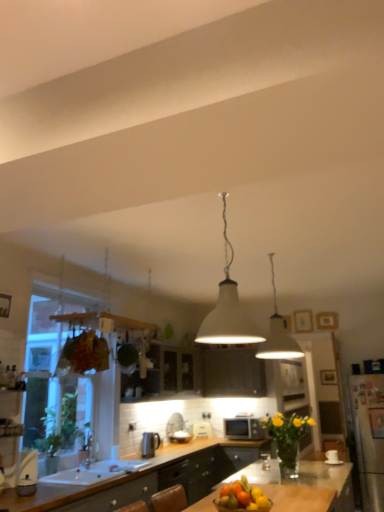
Question: From a real-world perspective, is white glossy sink at lower left physically located above or below transparent glass window at left?

Choices:
 (A) above
 (B) below

Answer: (B)

Question: Looking at the image, does white glossy sink at lower left seem bigger or smaller compared to transparent glass window at left?

Choices:
 (A) big
 (B) small

Answer: (B)

Question: Which object is the farthest from the matte black microwave at center?

Choices:
 (A) transparent glass window at left
 (B) white glossy sink at lower left
 (C) white glossy cabinet at center
 (D) white glossy toaster at center, which appears as the 2th appliance when viewed from the back
 (E) white matte lampshade at center, which is counted as the first lamp, starting from the front

Answer: (E)

Question: Estimate the real-world distances between objects in this image. Which object is closer to the matte black microwave at center?

Choices:
 (A) white matte lampshade at center, which is counted as the first lamp, starting from the front
 (B) white plastic toaster at center, marked as the first appliance in a right-to-left arrangement
 (C) white glossy toaster at center, which appears as the 2th appliance when viewed from the back
 (D) white matte lampshade at center, arranged as the second lamp when viewed from the left
 (E) white glossy sink at lower left

Answer: (B)